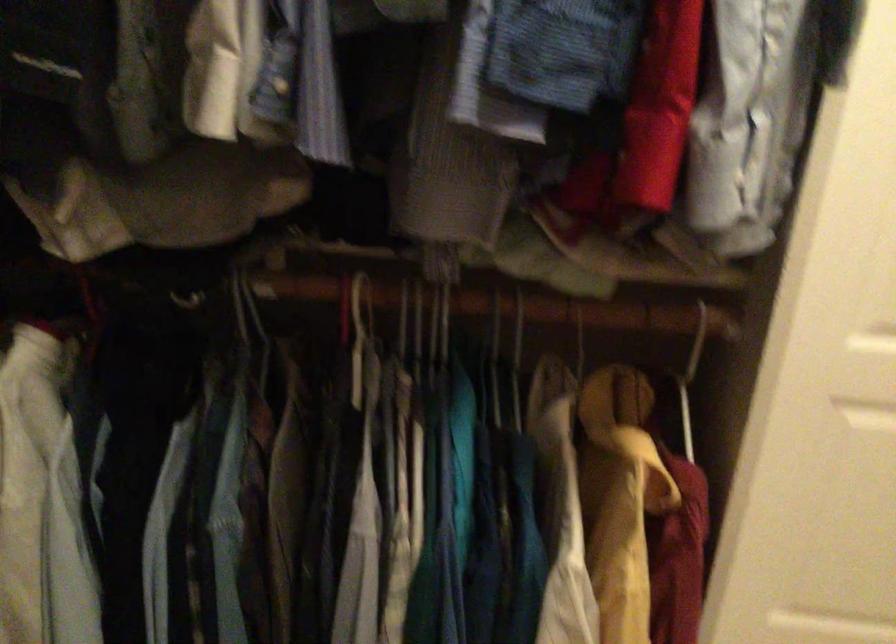
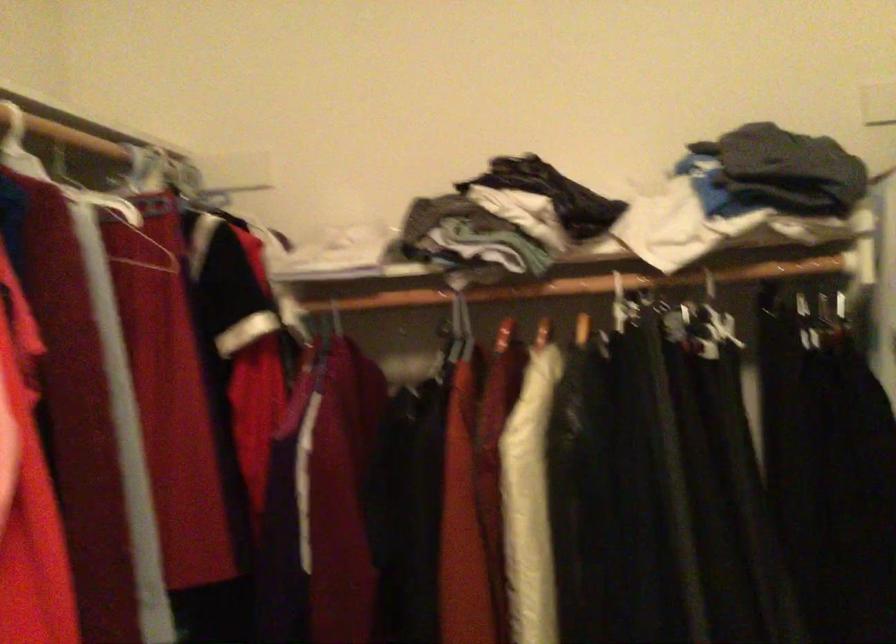
Question: How did the camera likely rotate?

Choices:
 (A) Left
 (B) Right
 (C) Up
 (D) Down

Answer: (A)